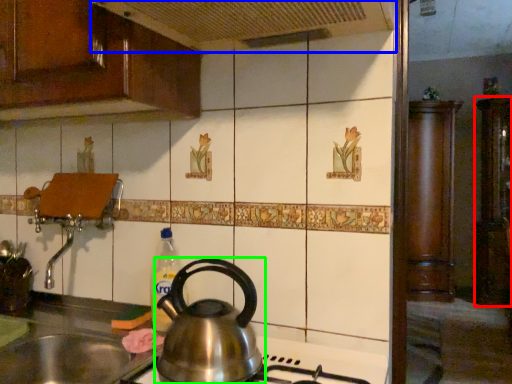
Question: Considering the real-world distances, which object is closest to cabinetry (highlighted by a red box)? exhaust hood (highlighted by a blue box) or kettle (highlighted by a green box).

Choices:
 (A) exhaust hood
 (B) kettle

Answer: (A)